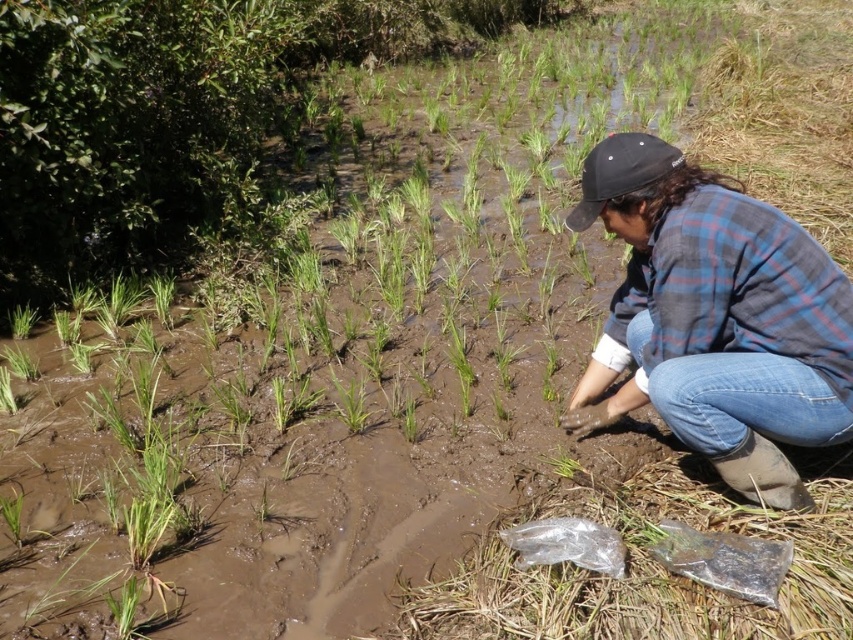
This screenshot has width=853, height=640. What are the coordinates of `blue plaid shirt at center right` in the screenshot? It's located at (715, 317).

Which is below, blue plaid shirt at center right or green grass at center?

green grass at center

Which is in front, point (567, 426) or point (335, 403)?

Point (567, 426) is more forward.

This screenshot has width=853, height=640. What are the coordinates of `blue plaid shirt at center right` in the screenshot? It's located at (715, 317).